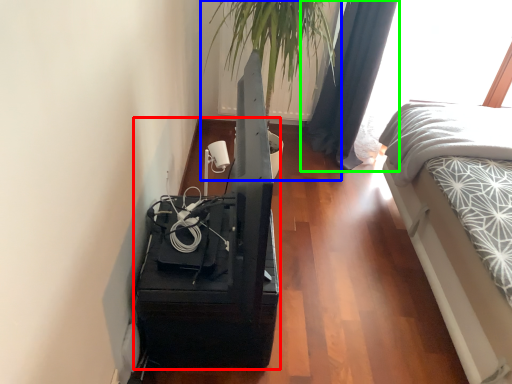
Question: Which is nearer to the furniture (highlighted by a red box)? houseplant (highlighted by a blue box) or curtain (highlighted by a green box).

Choices:
 (A) houseplant
 (B) curtain

Answer: (A)